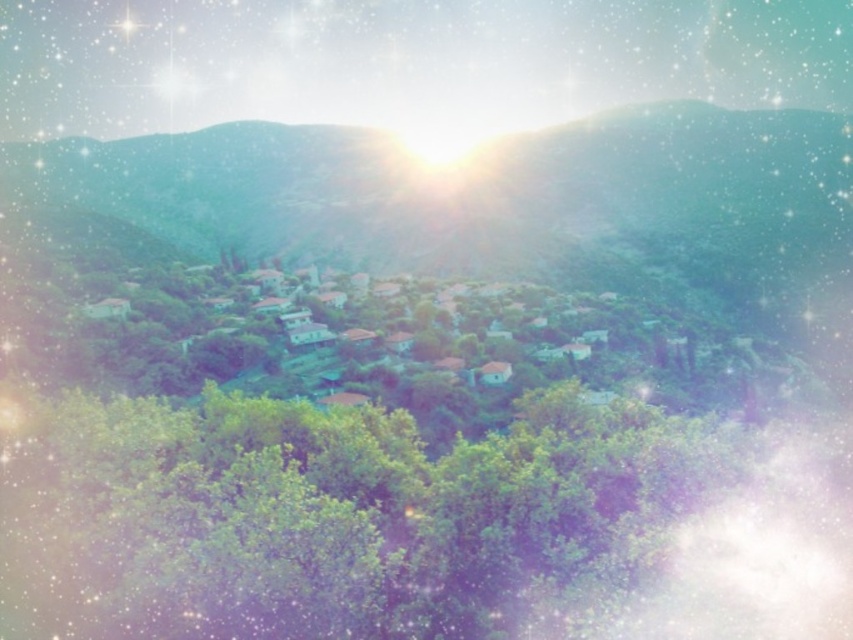
You are an artist setting up your easel to paint the landscape. You want to capture the green leafy tree at lower left and the green matte hillside at center in your painting. Which object should you place on the left side of your canvas?

The green leafy tree at lower left should be placed on the left side of your canvas because it is positioned on the left side of the green matte hillside at center in the actual scene.

You are standing in the landscape scene and want to reach the point marked at coordinates point (74, 632). Given that your walking speed is 1.5 meters per second, how many seconds will it take you to reach that point?

The point (74, 632) is 27.94 meters from the viewer. At a walking speed of 1.5 meters per second, it will take approximately 18.63 seconds to reach the point.